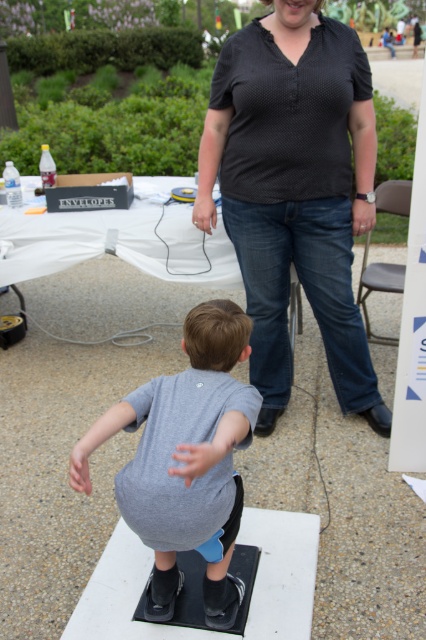
You are a photographer trying to capture a clear photo of both the black dotted shirt at center and the gray matte shirt at center. Which one should you focus on first to ensure it appears sharp in the photo?

The black dotted shirt at center is further to the viewer than the gray matte shirt at center, so you should focus on the black dotted shirt at center first to ensure both appear sharp.

You are a clothing designer observing the outdoor scene. You need to determine which shirt among the black dotted shirt at center and the gray matte shirt at center is more suitable for a child. Based on their sizes, which one would you recommend?

The black dotted shirt at center has a larger size compared to gray matte shirt at center. Since children often need larger sizes for comfort and growth, the black dotted shirt at center would be more suitable for a child.

Looking at this image, you are trying to decide which shirt to wear for a casual day out. The black dotted shirt at center and the gray matte shirt at center are both options. Based on the image, which one has a looser fit?

The black dotted shirt at center might be wider than gray matte shirt at center, so it likely has a looser fit.